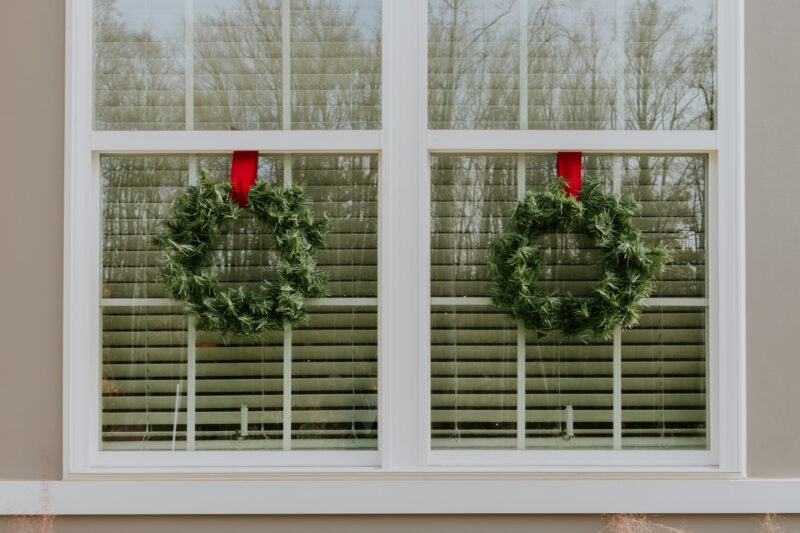
You are a GUI agent. You are given a task and a screenshot of the screen. Output one action in this format:
    pyautogui.click(x=<x>, y=<y>)
    Task: Click on the upper left window pane
    
    Given the screenshot: What is the action you would take?
    pyautogui.click(x=141, y=70)